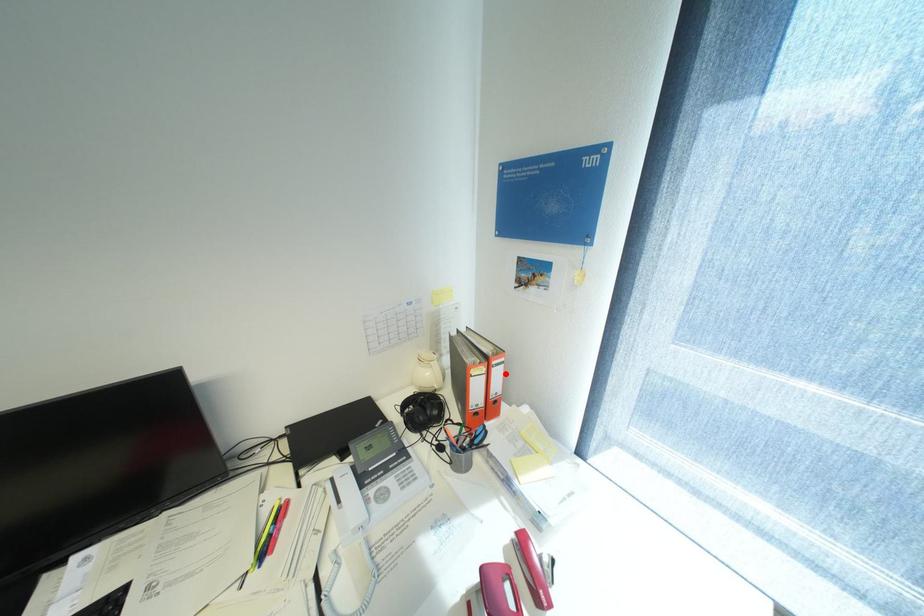
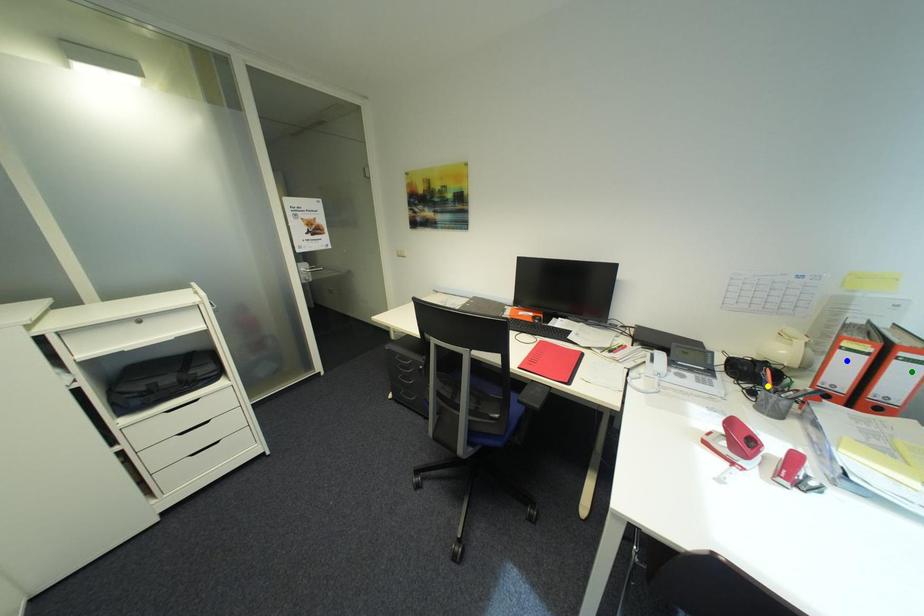
Question: I am providing you with two images of the same scene from different viewpoints. A red point is marked on the first image. You are given multiple points on the second image. Which spot in image 2 lines up with the point in image 1?

Choices:
 (A) green point
 (B) yellow point
 (C) blue point

Answer: (A)